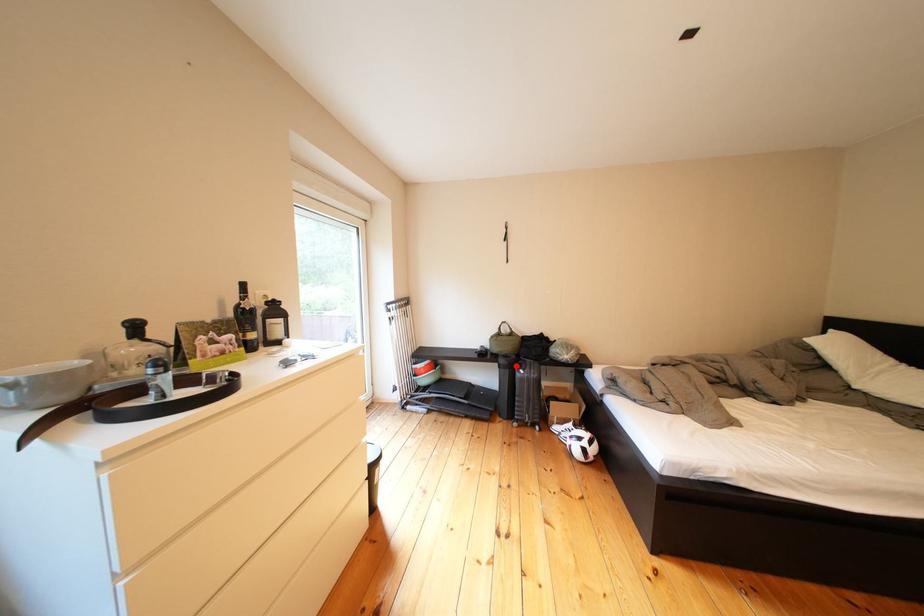
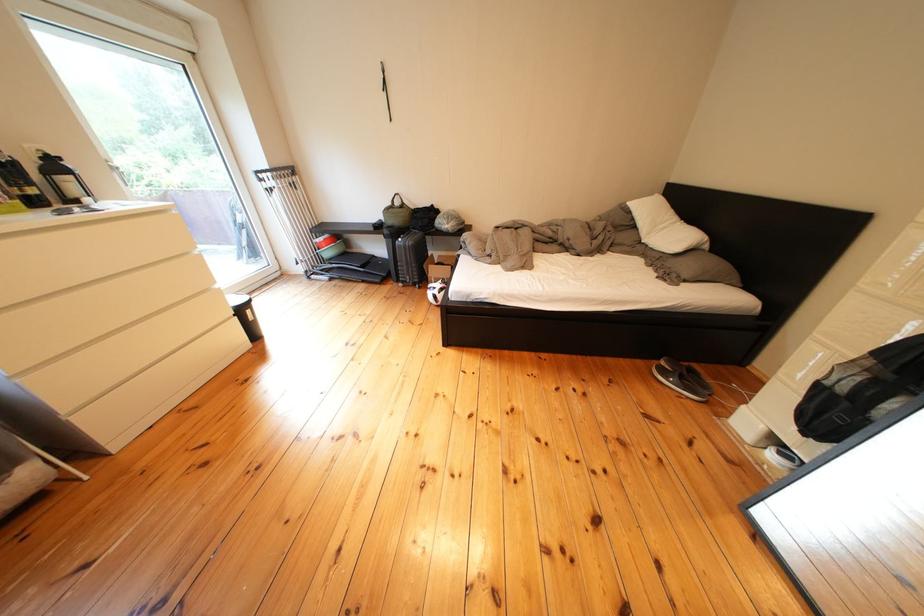
Question: I am providing you with two images of the same scene from different viewpoints. Given a red point in image1, look at the same physical point in image2. Is it:

Choices:
 (A) Closer to the viewpoint
 (B) Farther from the viewpoint

Answer: (A)